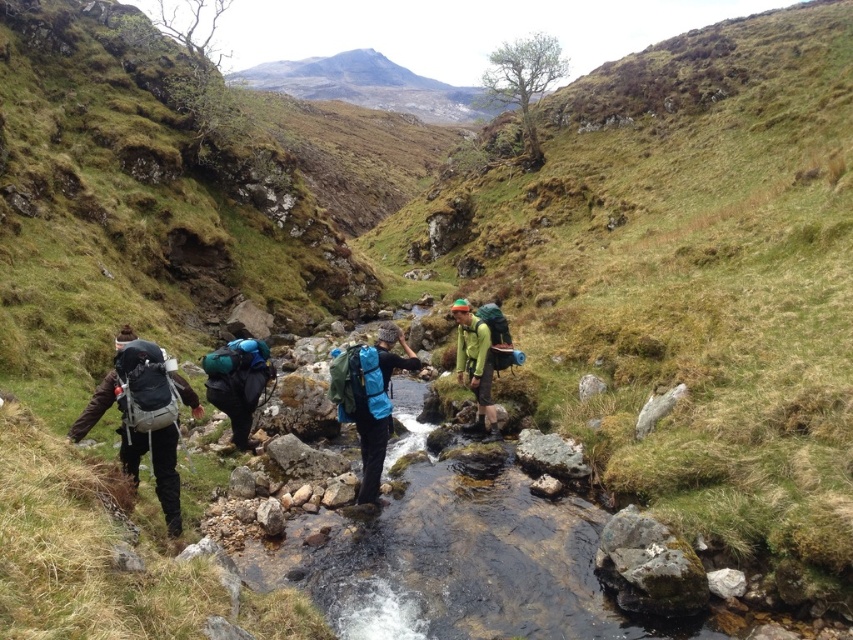
Does blue fabric backpack at center appear over green matte jacket at center?

Incorrect, blue fabric backpack at center is not positioned above green matte jacket at center.

How far apart are blue fabric backpack at center and green matte jacket at center?

blue fabric backpack at center is 10.69 feet from green matte jacket at center.

This screenshot has height=640, width=853. Find the location of `blue fabric backpack at center`. blue fabric backpack at center is located at coordinates pos(370,397).

I want to click on blue fabric backpack at center, so click(370, 397).

Does matte blue backpack at center appear on the left side of green matte jacket at center?

Yes, matte blue backpack at center is to the left of green matte jacket at center.

The width and height of the screenshot is (853, 640). What do you see at coordinates (236, 381) in the screenshot? I see `matte blue backpack at center` at bounding box center [236, 381].

The image size is (853, 640). Identify the location of matte blue backpack at center. (236, 381).

Does matte black backpack at left appear on the left side of blue fabric backpack at center?

Indeed, matte black backpack at left is positioned on the left side of blue fabric backpack at center.

Locate an element on the screen. This screenshot has height=640, width=853. matte black backpack at left is located at coordinates (155, 465).

You are a GUI agent. You are given a task and a screenshot of the screen. Output one action in this format:
    pyautogui.click(x=<x>, y=<y>)
    Task: Click on the matte black backpack at left
    This screenshot has height=640, width=853.
    Given the screenshot: What is the action you would take?
    pyautogui.click(x=155, y=465)